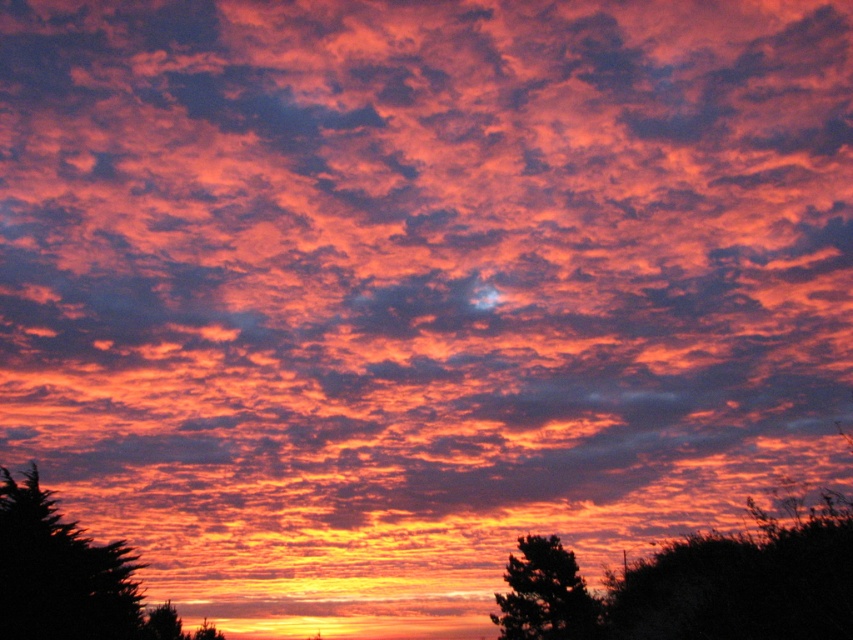
Who is more forward, (x=61, y=595) or (x=521, y=550)?

Point (x=61, y=595)

Is point (44, 552) closer to viewer compared to point (579, 612)?

Yes, point (44, 552) is closer to viewer.

The image size is (853, 640). What are the coordinates of `dark green leafy tree at lower left` in the screenshot? It's located at (68, 577).